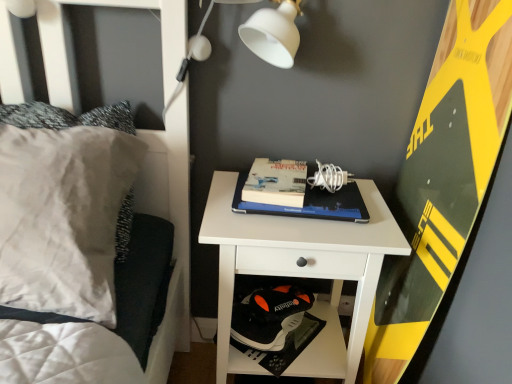
Question: Which direction should I rotate to face hardcover book at center, which is the 1th paperback book from left to right, — up or down?

Choices:
 (A) up
 (B) down

Answer: (A)

Question: Can we say white matte lampshade at upper center lies outside hardcover book at center, the second paperback book when ordered from right to left?

Choices:
 (A) yes
 (B) no

Answer: (A)

Question: Does white matte lampshade at upper center have a greater height compared to hardcover book at center, which is the 1th paperback book from left to right?

Choices:
 (A) no
 (B) yes

Answer: (B)

Question: Is white matte lampshade at upper center smaller than hardcover book at center, the second paperback book when ordered from right to left?

Choices:
 (A) yes
 (B) no

Answer: (B)

Question: Can hardcover book at center, which is the 1th paperback book from left to right, be found inside white matte lampshade at upper center?

Choices:
 (A) yes
 (B) no

Answer: (B)

Question: Is white matte lampshade at upper center wider than hardcover book at center, which is the 1th paperback book from left to right?

Choices:
 (A) no
 (B) yes

Answer: (A)

Question: Can you confirm if white matte lampshade at upper center is positioned to the right of hardcover book at center, which is the 1th paperback book from left to right?

Choices:
 (A) no
 (B) yes

Answer: (A)

Question: Would you say white matte nightstand at center contains hardcover book at center, which is counted as the 2th paperback book, starting from the left?

Choices:
 (A) yes
 (B) no

Answer: (B)

Question: From a real-world perspective, is white matte nightstand at center positioned over hardcover book at center, which ranks as the 1th paperback book in right-to-left order, based on gravity?

Choices:
 (A) yes
 (B) no

Answer: (B)

Question: From the image's perspective, does white matte nightstand at center appear lower than hardcover book at center, which is counted as the 2th paperback book, starting from the left?

Choices:
 (A) no
 (B) yes

Answer: (B)

Question: Can you confirm if white matte nightstand at center is bigger than hardcover book at center, which is counted as the 2th paperback book, starting from the left?

Choices:
 (A) no
 (B) yes

Answer: (B)

Question: Considering the relative sizes of white matte nightstand at center and hardcover book at center, which is counted as the 2th paperback book, starting from the left, in the image provided, is white matte nightstand at center taller than hardcover book at center, which is counted as the 2th paperback book, starting from the left,?

Choices:
 (A) no
 (B) yes

Answer: (B)

Question: Is the depth of white matte nightstand at center greater than that of hardcover book at center, which ranks as the 1th paperback book in right-to-left order?

Choices:
 (A) no
 (B) yes

Answer: (A)

Question: From the image's perspective, is hardcover book at center, which is counted as the 2th paperback book, starting from the left, above yellow-green textured board at right?

Choices:
 (A) yes
 (B) no

Answer: (A)